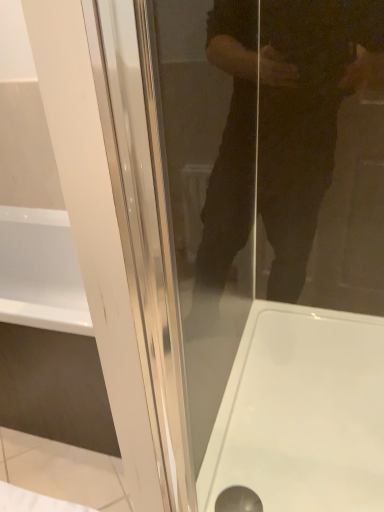
What do you see at coordinates (302, 413) in the screenshot? I see `white glossy bathtub at center` at bounding box center [302, 413].

Find the location of a particular element. white glossy bathtub at center is located at coordinates (302, 413).

What is the approximate height of white glossy bathtub at center?

9.79 inches.

Where is `white glossy bathtub at center`? Image resolution: width=384 pixels, height=512 pixels. white glossy bathtub at center is located at coordinates (302, 413).